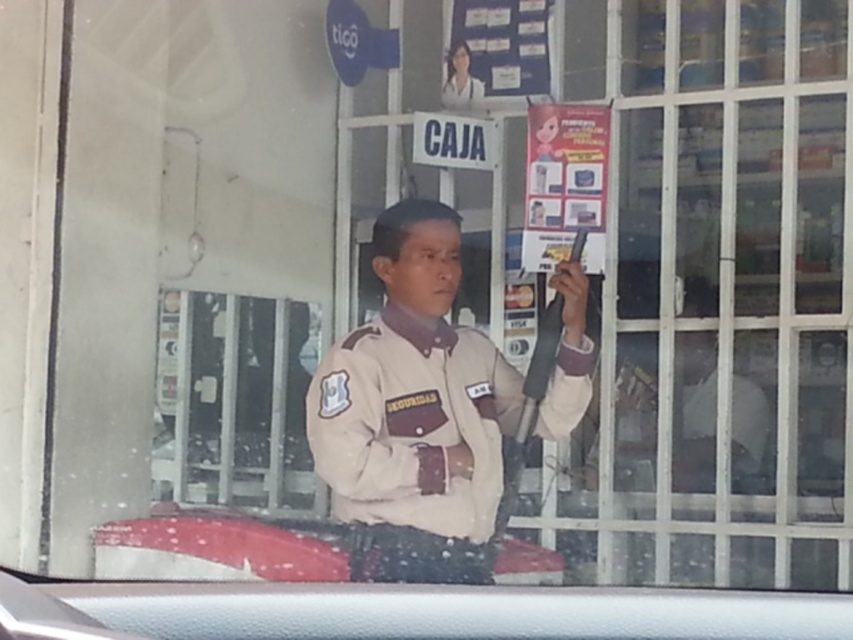
Between beige fabric uniform at center and matte paper poster at upper center, which one is positioned higher?

Positioned higher is matte paper poster at upper center.

Is beige fabric uniform at center shorter than matte paper poster at upper center?

No, beige fabric uniform at center is not shorter than matte paper poster at upper center.

Find the location of a particular element. This screenshot has width=853, height=640. beige fabric uniform at center is located at coordinates (413, 424).